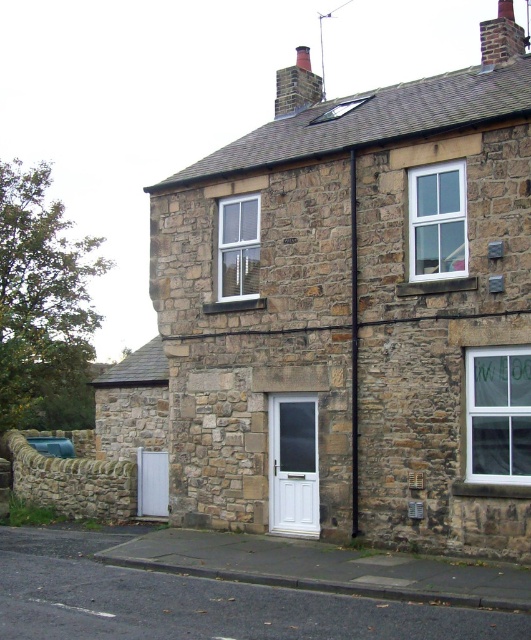
Is smooth brick chimney at upper center behind smooth brick chimney at upper right?

Yes.

Identify the location of smooth brick chimney at upper center. (296, 84).

Between white plastic door at center and smooth brick chimney at upper center, which one has more height?

With more height is smooth brick chimney at upper center.

Measure the distance between white plastic door at center and camera.

A distance of 46.31 feet exists between white plastic door at center and camera.

Describe the element at coordinates (294, 465) in the screenshot. The height and width of the screenshot is (640, 531). I see `white plastic door at center` at that location.

Where is `white plastic door at center`? Image resolution: width=531 pixels, height=640 pixels. white plastic door at center is located at coordinates (294, 465).

Can you confirm if white plastic door at center is positioned above smooth brick chimney at upper right?

No, white plastic door at center is not above smooth brick chimney at upper right.

Between white plastic door at center and smooth brick chimney at upper right, which one appears on the right side from the viewer's perspective?

smooth brick chimney at upper right

The width and height of the screenshot is (531, 640). Find the location of `white plastic door at center`. white plastic door at center is located at coordinates (294, 465).

Where is `white plastic door at center`? Image resolution: width=531 pixels, height=640 pixels. white plastic door at center is located at coordinates (294, 465).